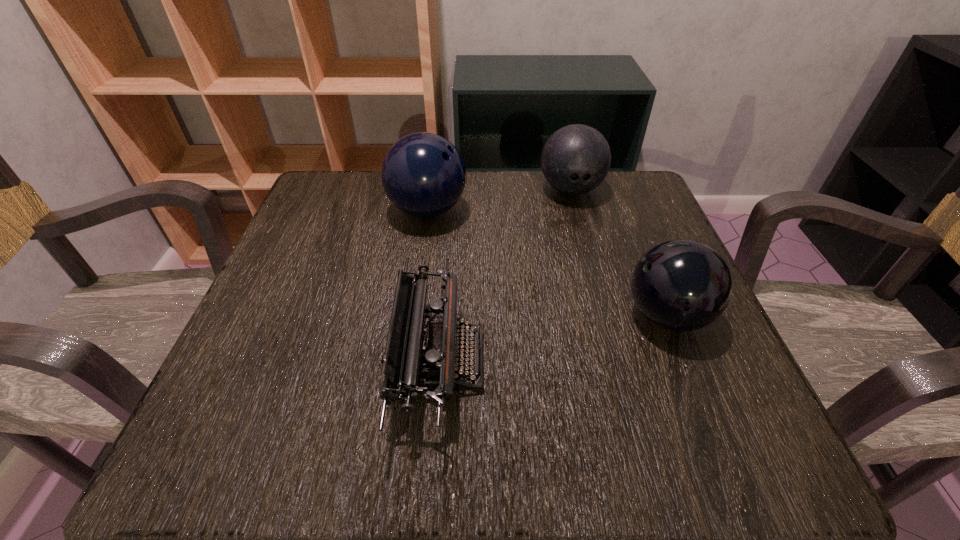
Identify the location of free region at the far edge of the desktop. Image resolution: width=960 pixels, height=540 pixels. (503, 171).

In the image, there is a desktop. Where is `vacant space at the near edge`? This screenshot has height=540, width=960. vacant space at the near edge is located at coordinates (390, 429).

In order to click on free space at the left edge of the desktop in this screenshot , I will do coord(283,305).

What are the coordinates of `vacant space at the right edge` in the screenshot? It's located at (678, 386).

I want to click on free space at the far left corner of the desktop, so click(332, 170).

The height and width of the screenshot is (540, 960). In the image, there is a desktop. Find the location of `vacant region at the near left corner`. vacant region at the near left corner is located at coordinates (182, 448).

This screenshot has width=960, height=540. In the image, there is a desktop. In order to click on vacant space at the far right corner in this screenshot , I will do `click(619, 188)`.

Find the location of a particular element. free space between the typewriter and the nearest bowling ball is located at coordinates (553, 338).

Find the location of `vacant space that is in between the typewriter and the leftmost bowling ball`. vacant space that is in between the typewriter and the leftmost bowling ball is located at coordinates (434, 286).

Identify the location of free area in between the shortest object and the leftmost bowling ball. (434, 286).